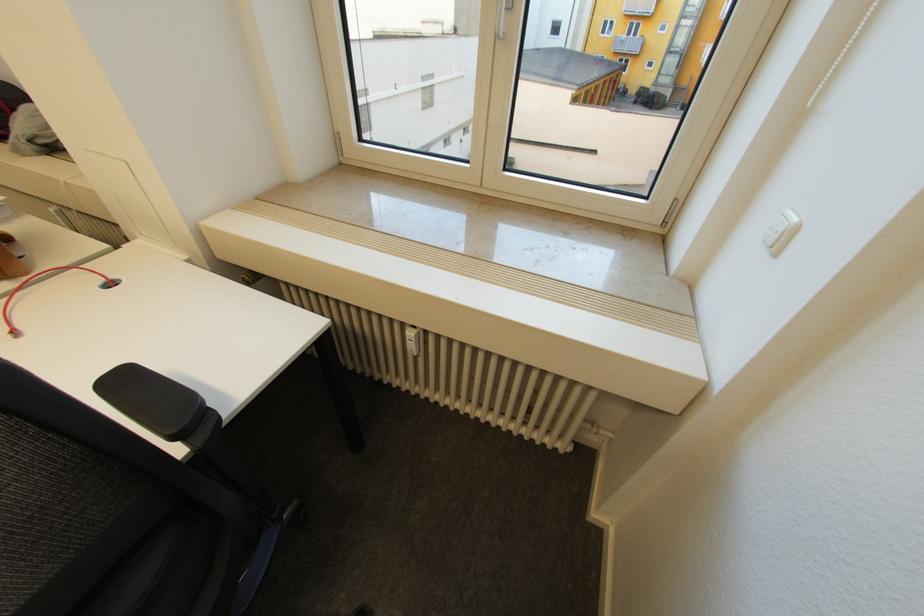
The height and width of the screenshot is (616, 924). What do you see at coordinates (454, 373) in the screenshot?
I see `the radiator thermostat` at bounding box center [454, 373].